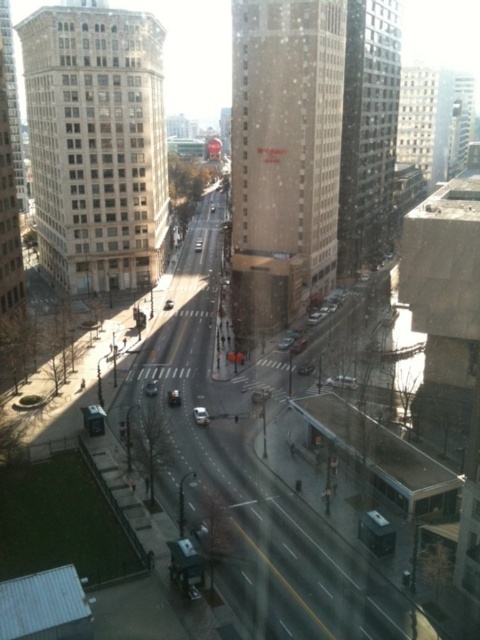
You are a delivery drone operator. Your drone is currently above the intersection and needs to land on the street. There are two silver metallic vehicles at the center. Which one is lower to the ground, the silver metallic sedan at center or the silver metallic car at center?

The silver metallic sedan at center is located below the silver metallic car at center, so the sedan is lower to the ground.